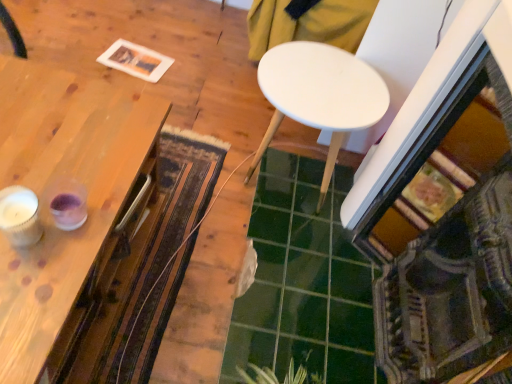
You are a GUI agent. You are given a task and a screenshot of the screen. Output one action in this format:
    pyautogui.click(x=<x>, y=<y>)
    Task: Click on the empty space that is in between white matte table at center, which appears as the 1th table when viewed from the right, and green glossy tile at center
    
    Given the screenshot: What is the action you would take?
    pyautogui.click(x=241, y=239)